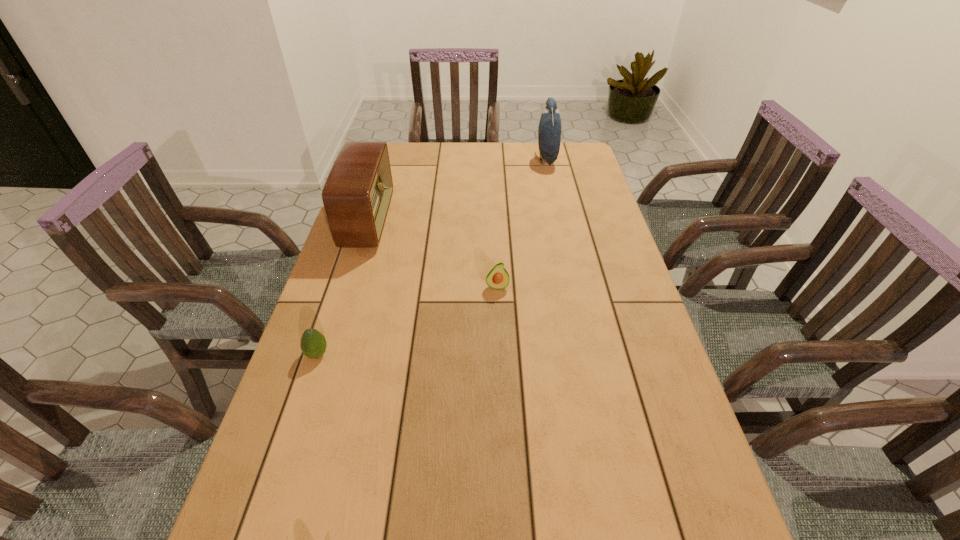
Locate an element on the screen. This screenshot has height=540, width=960. vacant position in the image that satisfies the following two spatial constraints: 1. at the tip of the bird's beak; 2. on the front side of the nearer avocado is located at coordinates (589, 354).